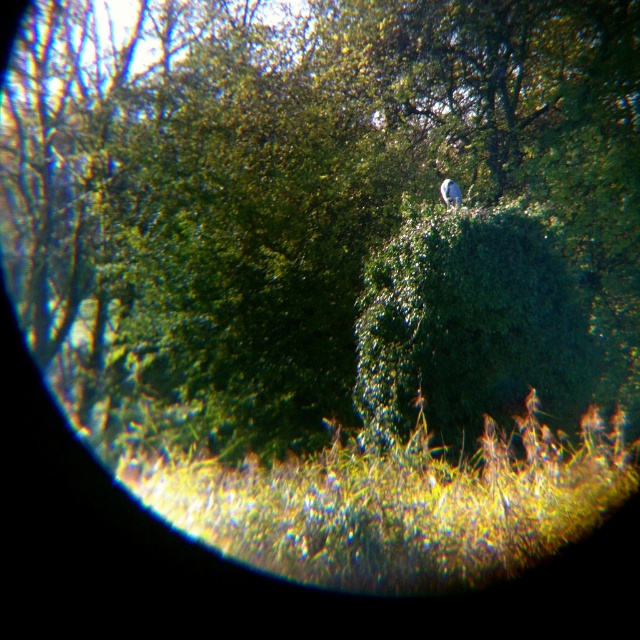
Based on the photo, you are a gardener looking to trim the green leafy hedge at center. You notice the green leafy tree at upper center. Which object is located above the other?

The green leafy tree at upper center is positioned over the green leafy hedge at center.

You are a photographer standing in the scene and want to take a photo of the white matte bird at upper center without the green leafy tree at upper center blocking it. Is this possible?

The green leafy tree at upper center is in front of the white matte bird at upper center, so the tree will block the view of the bird. You cannot take a photo of the white matte bird at upper center without the tree blocking it.

Looking at this image, you are standing in a garden and want to take a photo of the green leafy tree at upper center. If your camera has a maximum focus range of 8 meters, will you be able to focus on the tree?

The green leafy tree at upper center is 8.42 meters away from the viewer, which exceeds the camera maximum focus range of 8 meters. Therefore, the camera cannot focus on the tree.